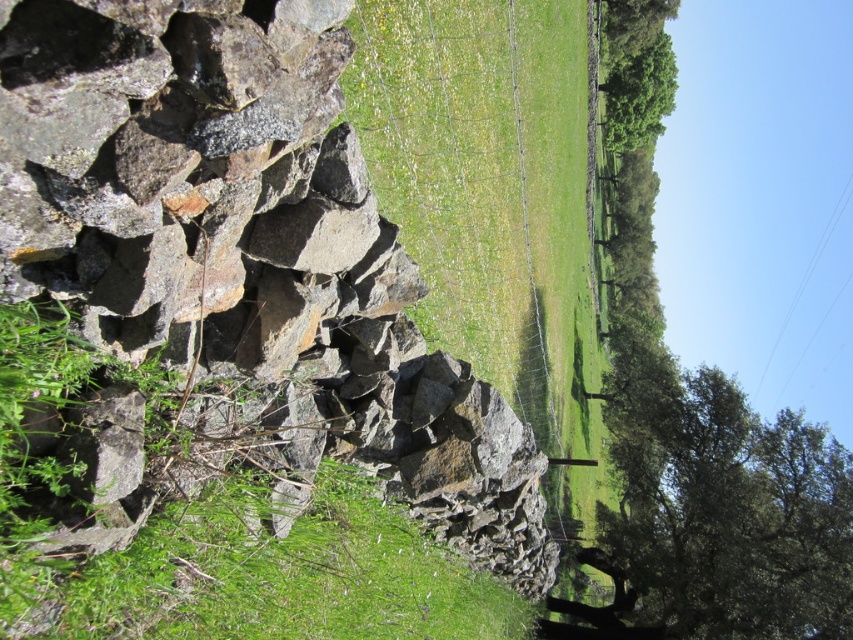
What do you see at coordinates (729, 512) in the screenshot? Image resolution: width=853 pixels, height=640 pixels. I see `green leafy tree at right` at bounding box center [729, 512].

Is green leafy tree at right closer to the viewer compared to clear blue wires at upper right?

That is True.

Which is in front, point (758, 584) or point (788, 314)?

Positioned in front is point (758, 584).

Locate an element on the screen. green leafy tree at right is located at coordinates (729, 512).

Between rusty stone wall at left and green grassy field at center, which one is positioned higher?

green grassy field at center

Who is more forward, (253, 330) or (526, 284)?

Point (253, 330)

The height and width of the screenshot is (640, 853). Describe the element at coordinates (248, 253) in the screenshot. I see `rusty stone wall at left` at that location.

Find the location of `rusty stone wall at left`. rusty stone wall at left is located at coordinates (248, 253).

Which is behind, point (822, 548) or point (606, 52)?

The point (606, 52) is behind.

Which of these two, green leafy tree at right or green leafy tree at upper right, stands taller?

green leafy tree at upper right

Which is behind, point (741, 513) or point (619, 138)?

The point (619, 138) is behind.

This screenshot has width=853, height=640. In order to click on green leafy tree at right in this screenshot , I will do pyautogui.click(x=729, y=512).